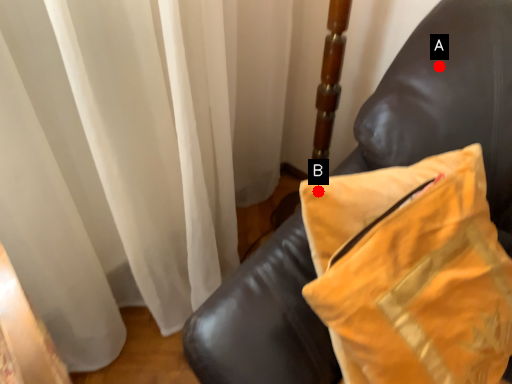
Question: Two points are circled on the image, labeled by A and B beside each circle. Which point is farther to the camera?

Choices:
 (A) A is further
 (B) B is further

Answer: (A)